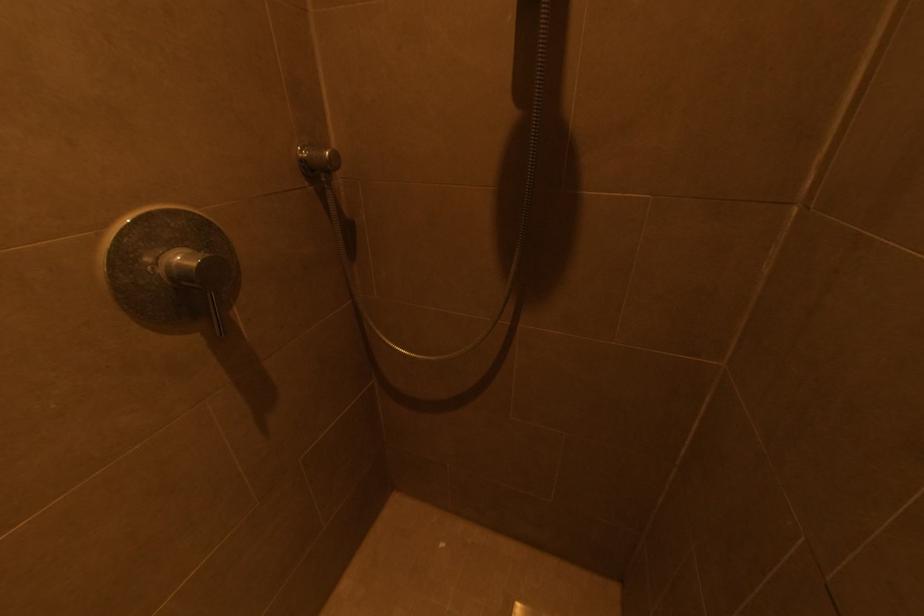
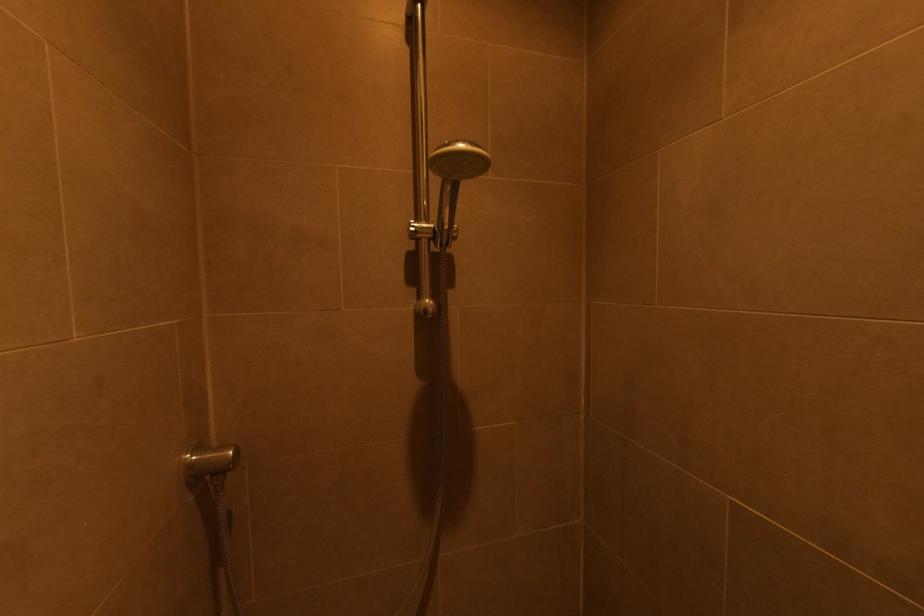
Locate, in the second image, the point that corresponds to [330,154] in the first image.

(232, 454)